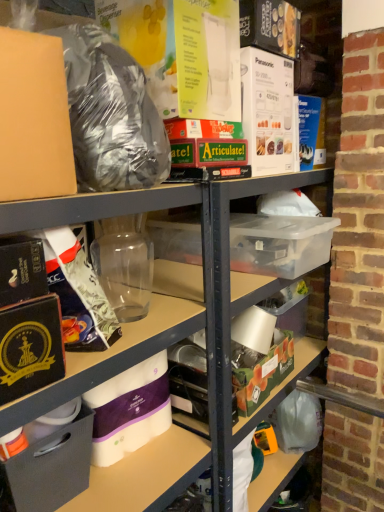
Question: From the image's perspective, is green matte box at center, acting as the 1th box starting from the right, beneath white matte toilet paper at lower center?

Choices:
 (A) yes
 (B) no

Answer: (B)

Question: Does green matte box at center, positioned as the 2th box in left-to-right order, appear on the left side of white matte toilet paper at lower center?

Choices:
 (A) yes
 (B) no

Answer: (B)

Question: Is green matte box at center, positioned as the 2th box in left-to-right order, smaller than white matte toilet paper at lower center?

Choices:
 (A) no
 (B) yes

Answer: (A)

Question: Can white matte toilet paper at lower center be found inside green matte box at center, acting as the 1th box starting from the right?

Choices:
 (A) no
 (B) yes

Answer: (A)

Question: Is green matte box at center, acting as the 1th box starting from the right, next to white matte toilet paper at lower center and touching it?

Choices:
 (A) no
 (B) yes

Answer: (A)

Question: Considering the positions of white matte toilet paper at lower center and green matte box at center, which ranks as the second box in front-to-back order, in the image, is white matte toilet paper at lower center bigger or smaller than green matte box at center, which ranks as the second box in front-to-back order,?

Choices:
 (A) big
 (B) small

Answer: (B)

Question: From the image's perspective, is white matte toilet paper at lower center above or below green matte box at center, positioned as the 2th box in left-to-right order?

Choices:
 (A) above
 (B) below

Answer: (B)

Question: Relative to green matte box at center, positioned as the 2th box in left-to-right order, is white matte toilet paper at lower center in front or behind?

Choices:
 (A) front
 (B) behind

Answer: (A)

Question: Visually, is white matte toilet paper at lower center positioned to the left or to the right of green matte box at center, which ranks as the second box in front-to-back order?

Choices:
 (A) right
 (B) left

Answer: (B)

Question: From a real-world perspective, is white matte toilet paper at lower center above or below matte black box at lower left, which ranks as the first box in front-to-back order?

Choices:
 (A) below
 (B) above

Answer: (B)

Question: Considering the positions of point (102, 419) and point (23, 488), is point (102, 419) closer or farther from the camera than point (23, 488)?

Choices:
 (A) closer
 (B) farther

Answer: (B)

Question: Would you say white matte toilet paper at lower center is to the left or to the right of matte black box at lower left, marked as the first box in a left-to-right arrangement, in the picture?

Choices:
 (A) left
 (B) right

Answer: (B)

Question: In the image, is white matte toilet paper at lower center positioned in front of or behind matte black box at lower left, which ranks as the first box in front-to-back order?

Choices:
 (A) front
 (B) behind

Answer: (B)

Question: Considering the relative positions of matte black box at lower left, positioned as the second box in right-to-left order, and green matte box at center, the 1th box viewed from the back, in the image provided, is matte black box at lower left, positioned as the second box in right-to-left order, to the left or to the right of green matte box at center, the 1th box viewed from the back,?

Choices:
 (A) left
 (B) right

Answer: (A)

Question: Is matte black box at lower left, marked as the first box in a left-to-right arrangement, wider or thinner than green matte box at center, the 1th box viewed from the back?

Choices:
 (A) wide
 (B) thin

Answer: (A)